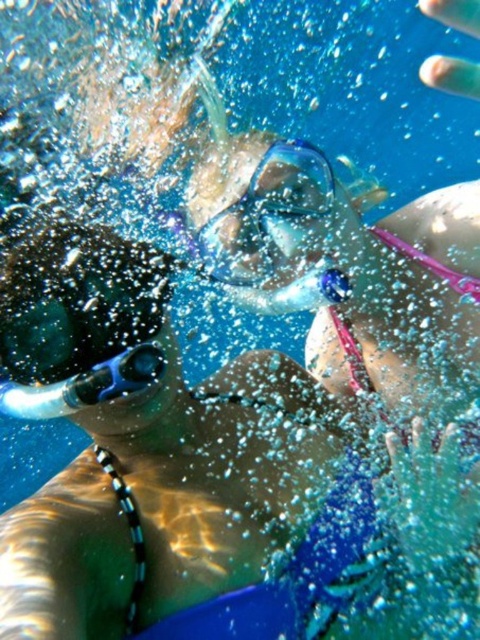
You are a marine biologist observing an underwater scene. You notice the transparent plastic goggles at center and the blue rubber snorkel at lower left. Which object is positioned closer to the right side of the image?

The transparent plastic goggles at center is to the right of the blue rubber snorkel at lower left, so it is positioned closer to the right side of the image.

You are a marine biologist analyzing an underwater image. You need to determine the position of the transparent plastic goggles at center relative to the two snorkelers. Based on the coordinates provided, which snorkeler is closer to the goggles?

The transparent plastic goggles at center is located at point [268,216]. Since the snorkeler on the left is positioned at coordinates..., the goggles are closer to the left snorkeler.